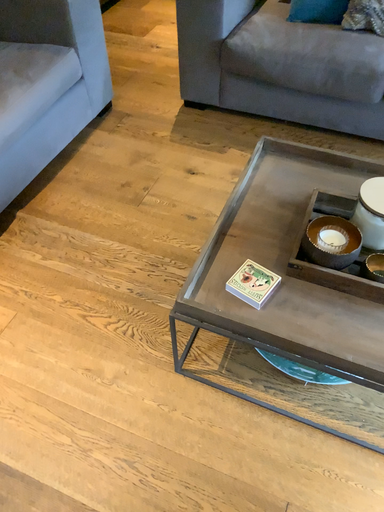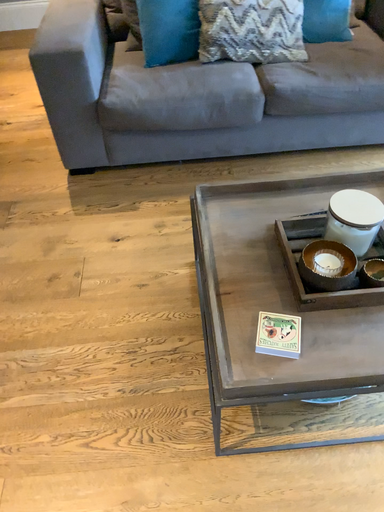
Question: Which way did the camera rotate in the video?

Choices:
 (A) rotated right
 (B) rotated left

Answer: (A)